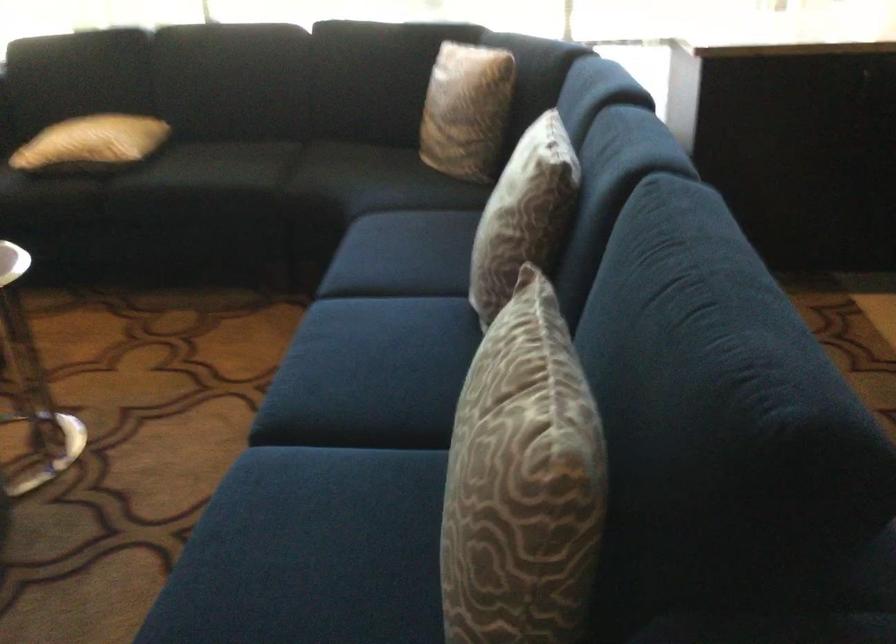
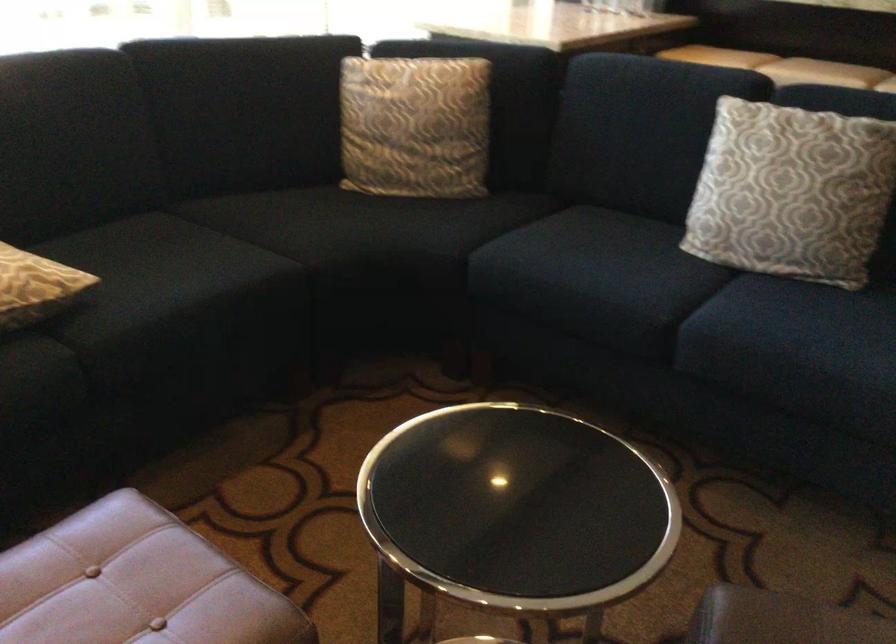
Locate, in the second image, the point that corresponds to pixel 488 220 in the first image.

(791, 192)